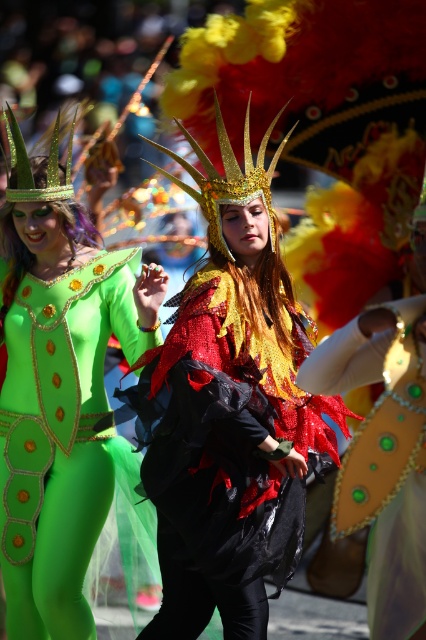
Who is lower down, shiny metallic costume at center or shiny gold mask at center?

shiny gold mask at center

Can you confirm if shiny metallic costume at center is wider than shiny gold mask at center?

Yes.

Does point (181, 328) lie behind point (368, 589)?

Yes.

The image size is (426, 640). I want to click on shiny metallic costume at center, so click(x=229, y=412).

Looking at this image, who is positioned more to the right, shiny metallic costume at center or green matte bodysuit at left?

Positioned to the right is shiny metallic costume at center.

How distant is shiny metallic costume at center from green matte bodysuit at left?

shiny metallic costume at center is 91.91 centimeters away from green matte bodysuit at left.

The image size is (426, 640). Identify the location of shiny metallic costume at center. (229, 412).

Where is `green matte bodysuit at left`? green matte bodysuit at left is located at coordinates (58, 388).

Who is higher up, green matte bodysuit at left or shiny gold mask at center?

green matte bodysuit at left

This screenshot has width=426, height=640. Find the location of `green matte bodysuit at left`. green matte bodysuit at left is located at coordinates (58, 388).

Locate an element on the screen. green matte bodysuit at left is located at coordinates (58, 388).